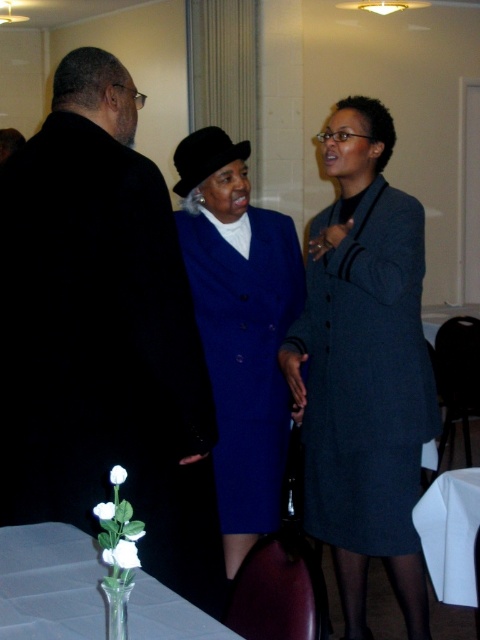
Question: Which of the following is the farthest from the observer?

Choices:
 (A) clear glass vase at lower left
 (B) dark gray wool coat at center
 (C) black matte coat at left
 (D) royal blue woolen coat at center

Answer: (D)

Question: Is black matte coat at left closer to the viewer compared to royal blue woolen coat at center?

Choices:
 (A) yes
 (B) no

Answer: (A)

Question: Which point is closer to the camera?

Choices:
 (A) clear glass vase at lower left
 (B) white paper napkin at lower right
 (C) dark gray wool coat at center
 (D) royal blue woolen coat at center

Answer: (A)

Question: Does black matte coat at left lie in front of clear glass vase at lower left?

Choices:
 (A) yes
 (B) no

Answer: (B)

Question: Which of the following is the farthest from the observer?

Choices:
 (A) (32, 269)
 (B) (241, 432)
 (C) (450, 544)
 (D) (368, 518)

Answer: (B)

Question: In this image, where is black matte coat at left located relative to white paper napkin at lower right?

Choices:
 (A) right
 (B) left

Answer: (B)